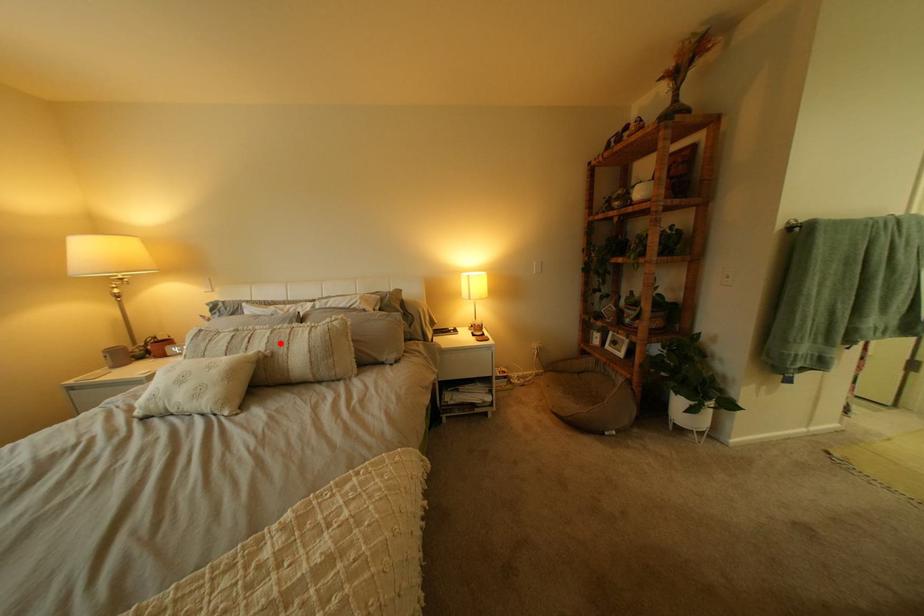
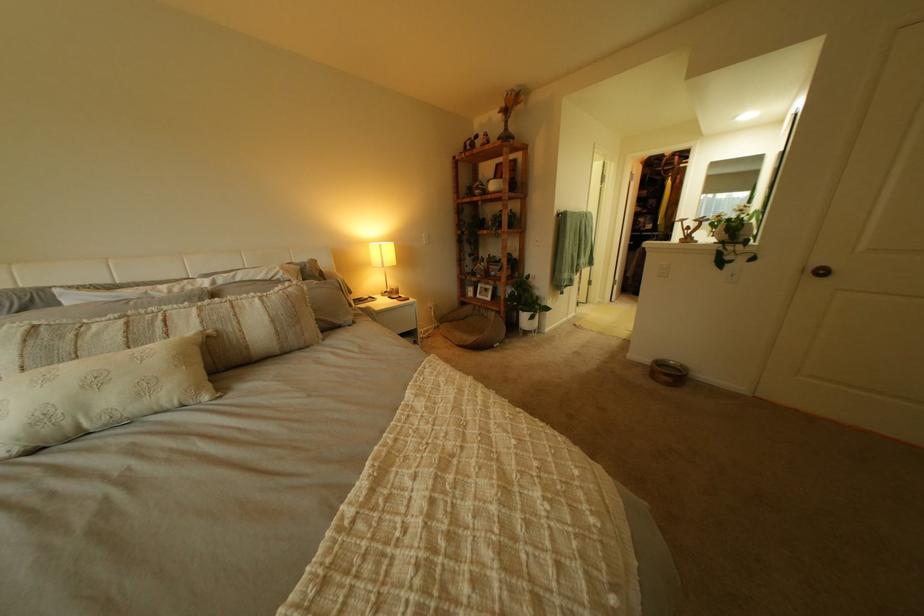
In the second image, find the point that corresponds to the highlighted location in the first image.

(213, 323)